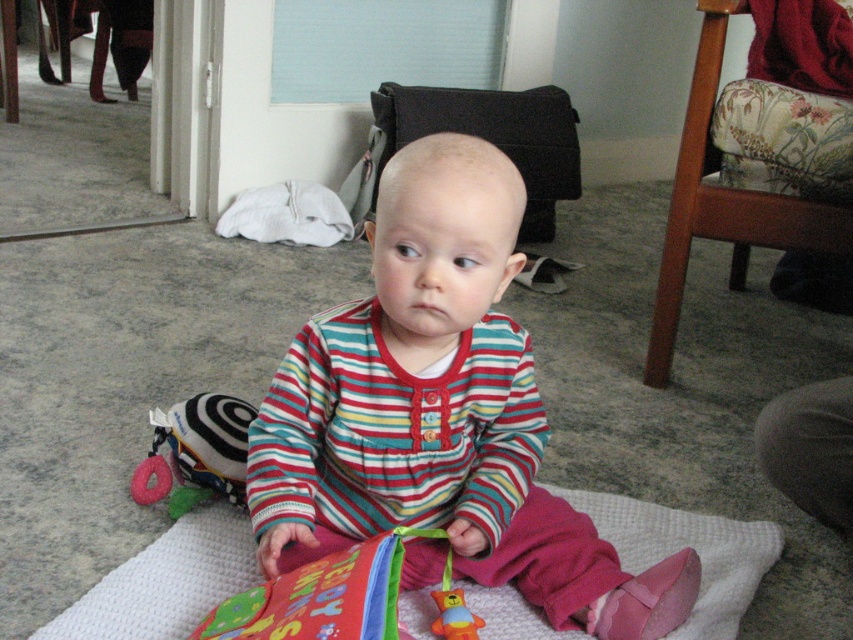
Does soft plush toy at lower left have a greater width compared to rubber duck toy at center?

Indeed, soft plush toy at lower left has a greater width compared to rubber duck toy at center.

Who is taller, soft plush toy at lower left or rubber duck toy at center?

soft plush toy at lower left

Locate an element on the screen. soft plush toy at lower left is located at coordinates (196, 452).

The image size is (853, 640). In order to click on soft plush toy at lower left in this screenshot , I will do `click(196, 452)`.

Can you confirm if striped fabric baby at center is bigger than rubber duck toy at center?

Yes, striped fabric baby at center is bigger than rubber duck toy at center.

Who is positioned more to the left, striped fabric baby at center or rubber duck toy at center?

striped fabric baby at center is more to the left.

Which is behind, point (508, 209) or point (482, 620)?

Positioned behind is point (482, 620).

At what (x,y) coordinates should I click in order to perform the action: click on striped fabric baby at center. Please return your answer as a coordinate pair (x, y). Image resolution: width=853 pixels, height=640 pixels. Looking at the image, I should click on (439, 413).

Does striped fabric baby at center have a lesser width compared to soft plush toy at lower left?

No.

Can you confirm if striped fabric baby at center is positioned to the left of soft plush toy at lower left?

In fact, striped fabric baby at center is to the right of soft plush toy at lower left.

Who is more forward, (477, 397) or (148, 460)?

Point (477, 397) is in front.

This screenshot has width=853, height=640. What are the coordinates of `striped fabric baby at center` in the screenshot? It's located at (439, 413).